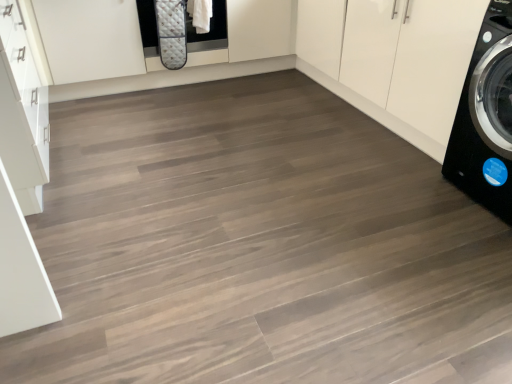
Question: Does white glossy cabinet at upper right have a smaller size compared to black glossy washing machine at right?

Choices:
 (A) yes
 (B) no

Answer: (B)

Question: Is white glossy cabinet at upper right further to the viewer compared to black glossy washing machine at right?

Choices:
 (A) no
 (B) yes

Answer: (B)

Question: Is white glossy cabinet at upper right turned away from black glossy washing machine at right?

Choices:
 (A) no
 (B) yes

Answer: (A)

Question: From the image's perspective, is white glossy cabinet at upper right over black glossy washing machine at right?

Choices:
 (A) yes
 (B) no

Answer: (A)

Question: Could you tell me if white glossy cabinet at upper right is facing black glossy washing machine at right?

Choices:
 (A) no
 (B) yes

Answer: (A)

Question: Considering the relative sizes of white glossy cabinet at upper right and black glossy washing machine at right in the image provided, is white glossy cabinet at upper right bigger than black glossy washing machine at right?

Choices:
 (A) no
 (B) yes

Answer: (B)

Question: Considering the relative sizes of black glossy washing machine at right and white glossy cabinet at upper right in the image provided, is black glossy washing machine at right thinner than white glossy cabinet at upper right?

Choices:
 (A) yes
 (B) no

Answer: (A)

Question: From a real-world perspective, is black glossy washing machine at right below white glossy cabinet at upper right?

Choices:
 (A) yes
 (B) no

Answer: (B)

Question: Is black glossy washing machine at right positioned before white glossy cabinet at upper right?

Choices:
 (A) yes
 (B) no

Answer: (A)

Question: Does black glossy washing machine at right appear on the right side of white glossy cabinet at upper right?

Choices:
 (A) no
 (B) yes

Answer: (B)

Question: From the image's perspective, is black glossy washing machine at right over white glossy cabinet at upper right?

Choices:
 (A) no
 (B) yes

Answer: (A)

Question: Can you confirm if black glossy washing machine at right is bigger than white glossy cabinet at upper right?

Choices:
 (A) yes
 (B) no

Answer: (B)

Question: In the image, is white glossy cabinet at upper right positioned in front of or behind black glossy washing machine at right?

Choices:
 (A) behind
 (B) front

Answer: (A)